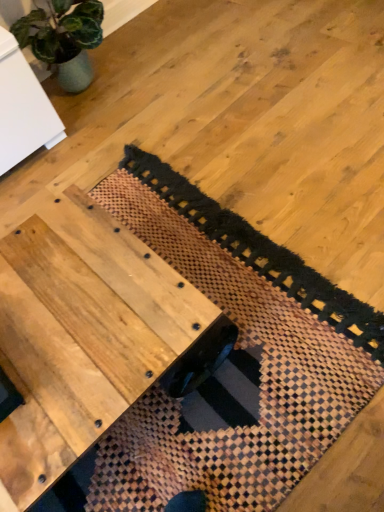
Locate an element on the screen. This screenshot has width=384, height=512. free spot to the right of wooden woven mat at center is located at coordinates (316, 151).